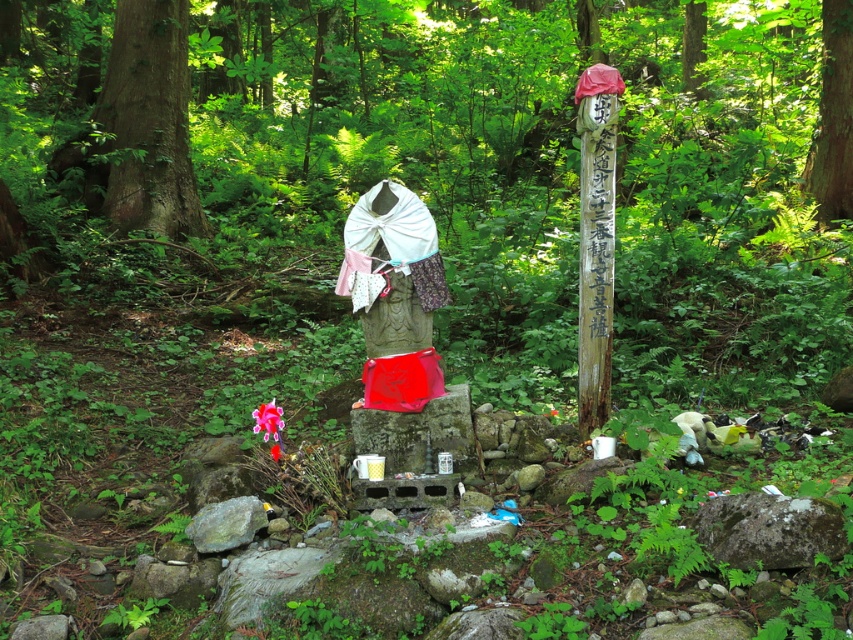
Consider the image. Does wooden carved totem pole at center right have a greater width compared to smooth brown tree trunk at center?

No.

What do you see at coordinates (595, 237) in the screenshot? The image size is (853, 640). I see `wooden carved totem pole at center right` at bounding box center [595, 237].

Describe the element at coordinates (595, 237) in the screenshot. The image size is (853, 640). I see `wooden carved totem pole at center right` at that location.

You are a GUI agent. You are given a task and a screenshot of the screen. Output one action in this format:
    pyautogui.click(x=<x>, y=<y>)
    Task: Click on the wooden carved totem pole at center right
    Image resolution: width=853 pixels, height=640 pixels.
    Given the screenshot: What is the action you would take?
    pyautogui.click(x=595, y=237)

Is green rough bark tree at left wider than wooden carved totem pole at center right?

Indeed, green rough bark tree at left has a greater width compared to wooden carved totem pole at center right.

Can you confirm if green rough bark tree at left is positioned below wooden carved totem pole at center right?

No.

Does point (195, 198) come in front of point (585, 424)?

That is False.

At what (x,y) coordinates should I click in order to perform the action: click on green rough bark tree at left. Please return your answer as a coordinate pair (x, y). The height and width of the screenshot is (640, 853). Looking at the image, I should click on (149, 120).

Which of these two, green rough bark tree at left or smooth brown tree trunk at center, stands taller?

green rough bark tree at left

Can you confirm if green rough bark tree at left is positioned to the left of smooth brown tree trunk at center?

Indeed, green rough bark tree at left is positioned on the left side of smooth brown tree trunk at center.

Who is more distant from viewer, (161, 54) or (848, 88)?

The point (161, 54) is behind.

You are a GUI agent. You are given a task and a screenshot of the screen. Output one action in this format:
    pyautogui.click(x=<x>, y=<y>)
    Task: Click on the green rough bark tree at left
    The height and width of the screenshot is (640, 853).
    Given the screenshot: What is the action you would take?
    pyautogui.click(x=149, y=120)